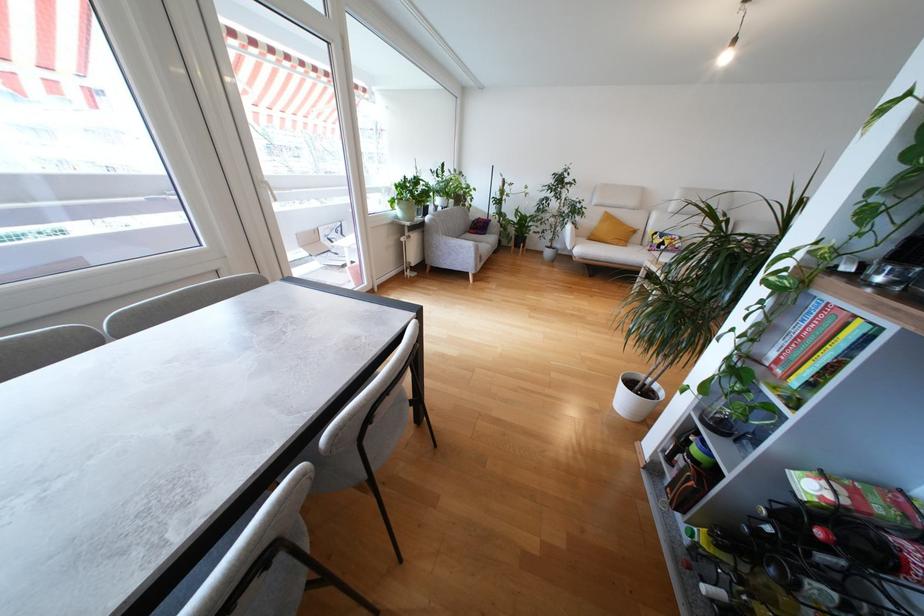
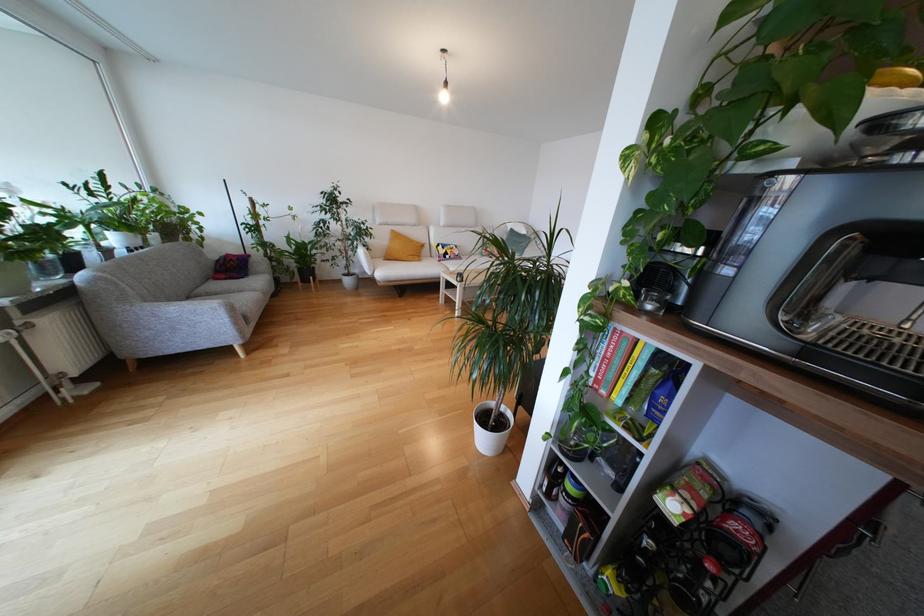
Where in the second image is the point corresponding to (x=492, y=230) from the first image?

(253, 268)